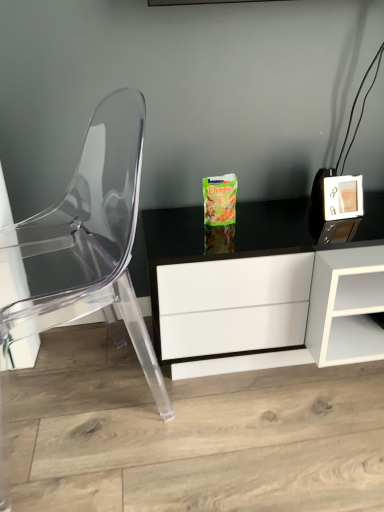
Question: Could you tell me if green matte snack packet at center is turned towards transparent plastic chair at left?

Choices:
 (A) no
 (B) yes

Answer: (A)

Question: Is green matte snack packet at center at the right side of transparent plastic chair at left?

Choices:
 (A) yes
 (B) no

Answer: (A)

Question: From the image's perspective, is green matte snack packet at center located above transparent plastic chair at left?

Choices:
 (A) yes
 (B) no

Answer: (B)

Question: From a real-world perspective, is green matte snack packet at center below transparent plastic chair at left?

Choices:
 (A) yes
 (B) no

Answer: (A)

Question: From a real-world perspective, is green matte snack packet at center positioned over transparent plastic chair at left based on gravity?

Choices:
 (A) no
 (B) yes

Answer: (A)

Question: Is green matte snack packet at center thinner than transparent plastic chair at left?

Choices:
 (A) no
 (B) yes

Answer: (A)

Question: Would you say transparent plastic chair at left is outside green matte snack packet at center?

Choices:
 (A) yes
 (B) no

Answer: (A)

Question: Does transparent plastic chair at left have a greater height compared to green matte snack packet at center?

Choices:
 (A) no
 (B) yes

Answer: (B)

Question: Is transparent plastic chair at left further to the viewer compared to green matte snack packet at center?

Choices:
 (A) yes
 (B) no

Answer: (B)

Question: From the image's perspective, is transparent plastic chair at left on green matte snack packet at center?

Choices:
 (A) no
 (B) yes

Answer: (B)

Question: From a real-world perspective, is transparent plastic chair at left positioned under green matte snack packet at center based on gravity?

Choices:
 (A) yes
 (B) no

Answer: (B)

Question: Could green matte snack packet at center be considered to be inside transparent plastic chair at left?

Choices:
 (A) yes
 (B) no

Answer: (B)

Question: In terms of height, does green matte snack packet at center look taller or shorter compared to transparent plastic chair at left?

Choices:
 (A) tall
 (B) short

Answer: (B)